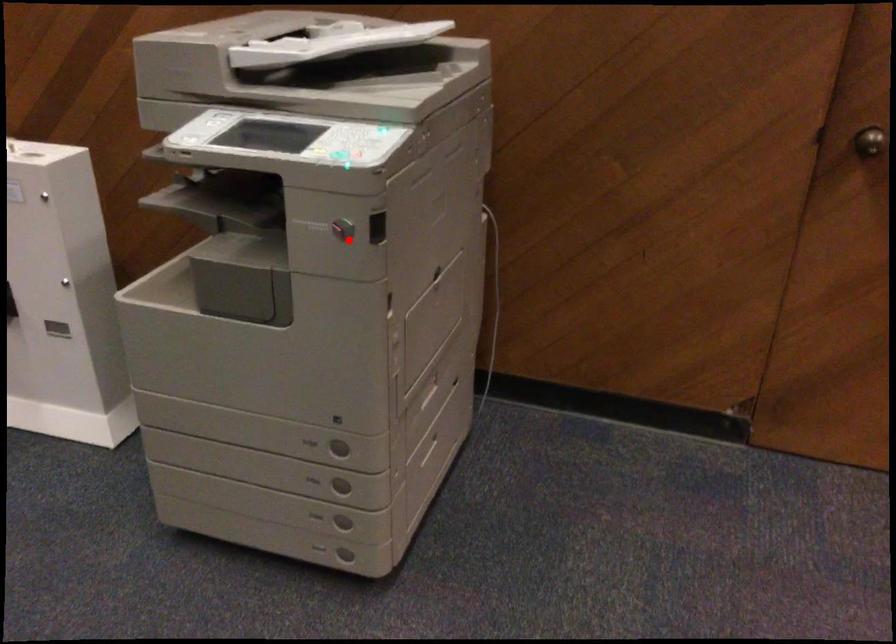
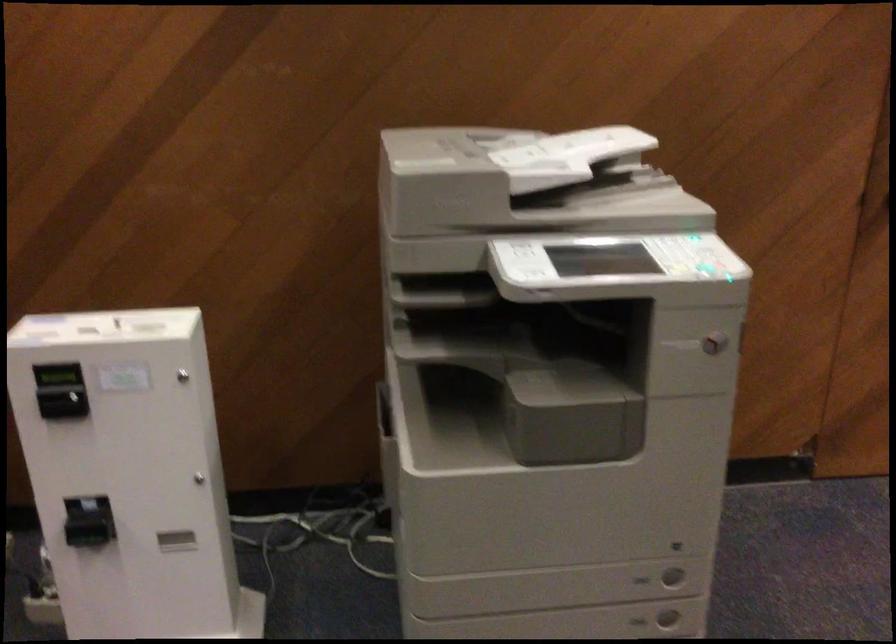
Question: I am providing you with two images of the same scene from different viewpoints. A red point is marked on the first image. Can you still see the location of the red point in image 2?

Choices:
 (A) Yes
 (B) No

Answer: (A)